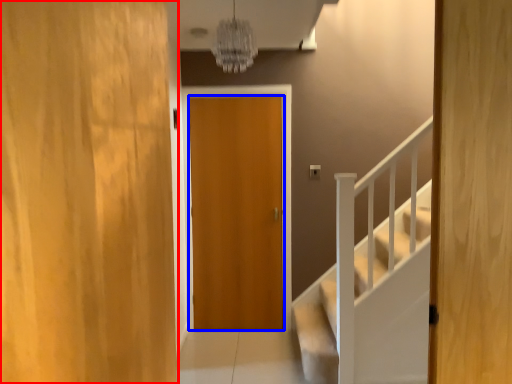
Question: Which of the following is the farthest to the observer, door (highlighted by a red box) or door (highlighted by a blue box)?

Choices:
 (A) door
 (B) door

Answer: (B)